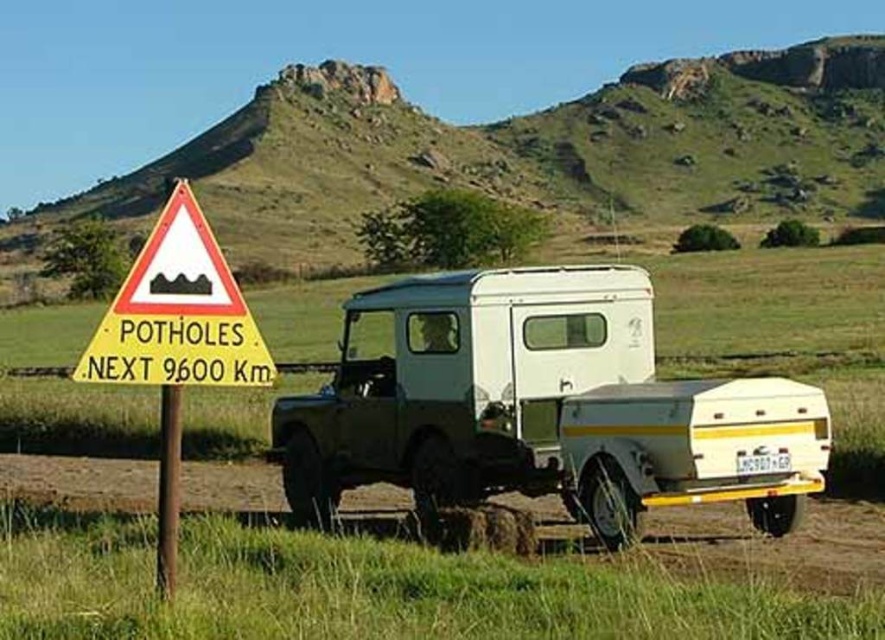
You are standing at the point with coordinates (541, 406) in the image. What object are you standing on?

You are standing on the white matte recreational vehicle at center.

You are a hiker planning to walk along the brown dirt track at lower center. There is a white matte recreational vehicle at center parked above the track. Can you walk under the vehicle without stepping off the track?

The white matte recreational vehicle at center is located above the brown dirt track at lower center, so yes, you can walk under the vehicle while staying on the track.